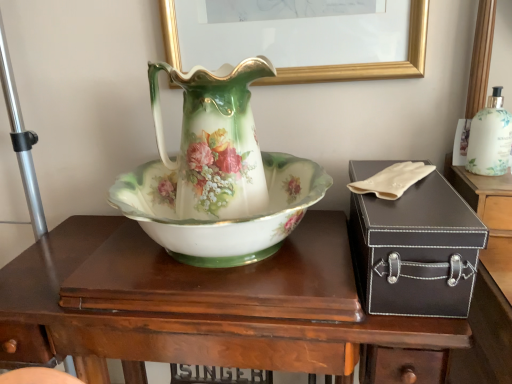
The width and height of the screenshot is (512, 384). What are the coordinates of `empty space that is ontop of black leather suitcase at right (from a real-world perspective)` in the screenshot? It's located at (398, 183).